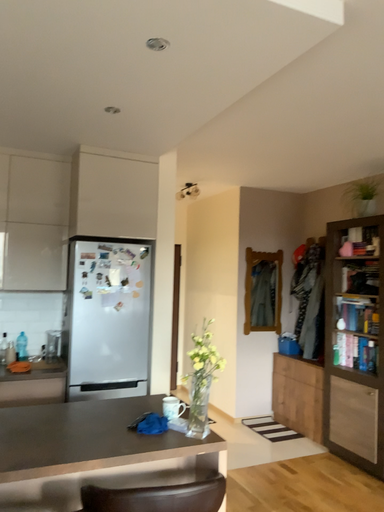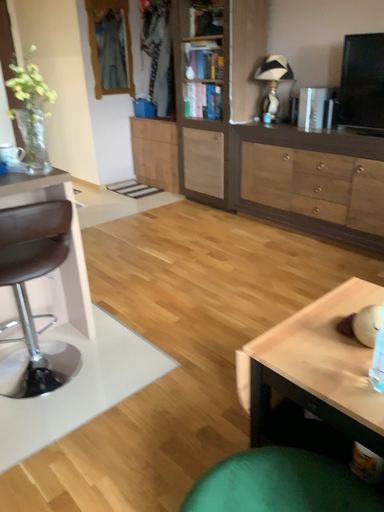
Question: How did the camera likely rotate when shooting the video?

Choices:
 (A) rotated downward
 (B) rotated upward

Answer: (A)